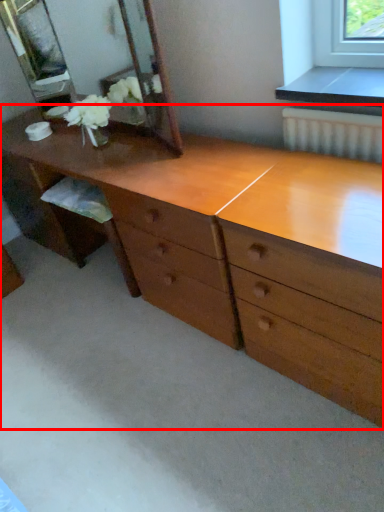
Question: Where is chest of drawers (annotated by the red box) located in relation to mirror in the image?

Choices:
 (A) left
 (B) right

Answer: (B)